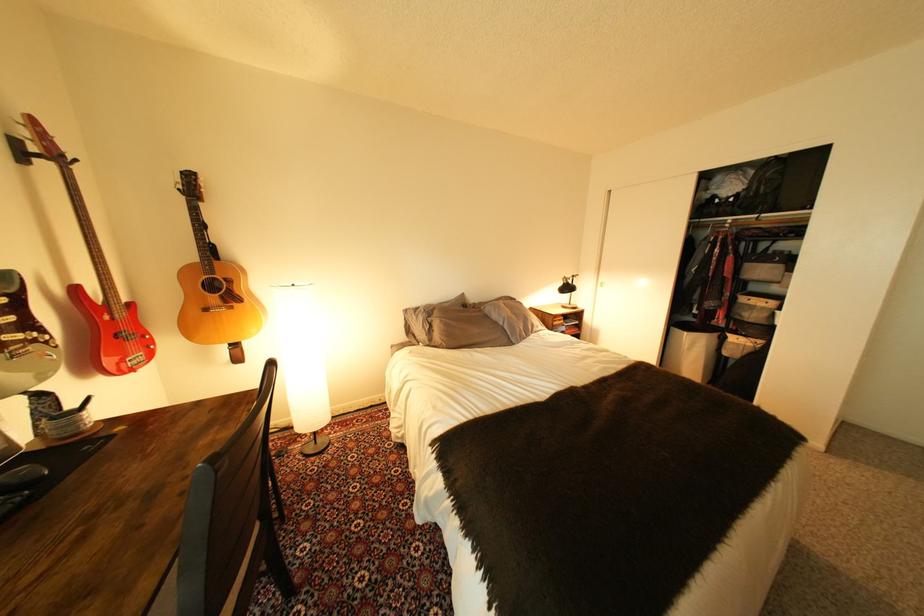
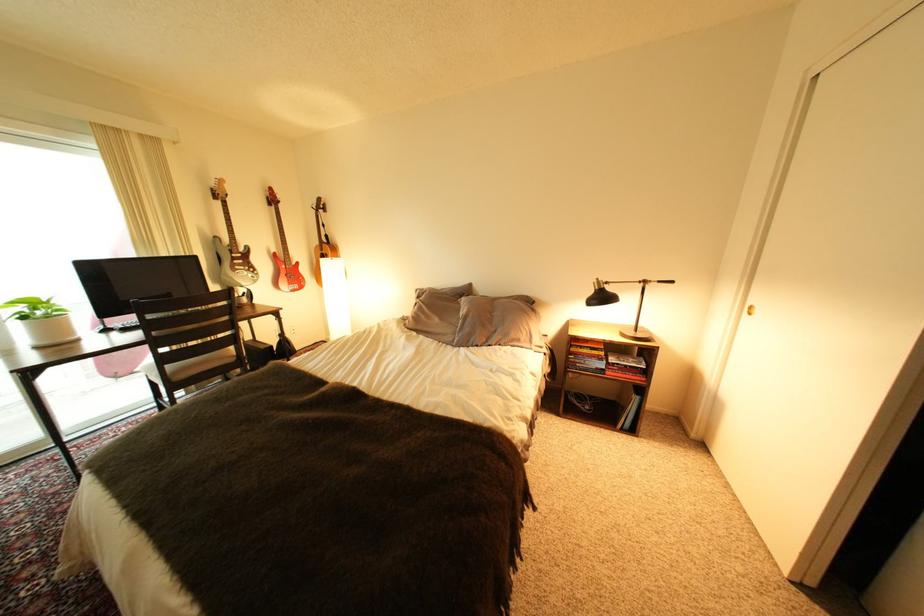
Locate, in the second image, the point that corresponds to (x=497, y=309) in the first image.

(473, 302)